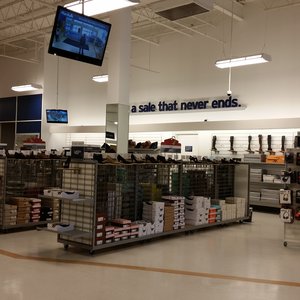
Image resolution: width=300 pixels, height=300 pixels. Find the location of `monitor`. monitor is located at coordinates (58, 117).